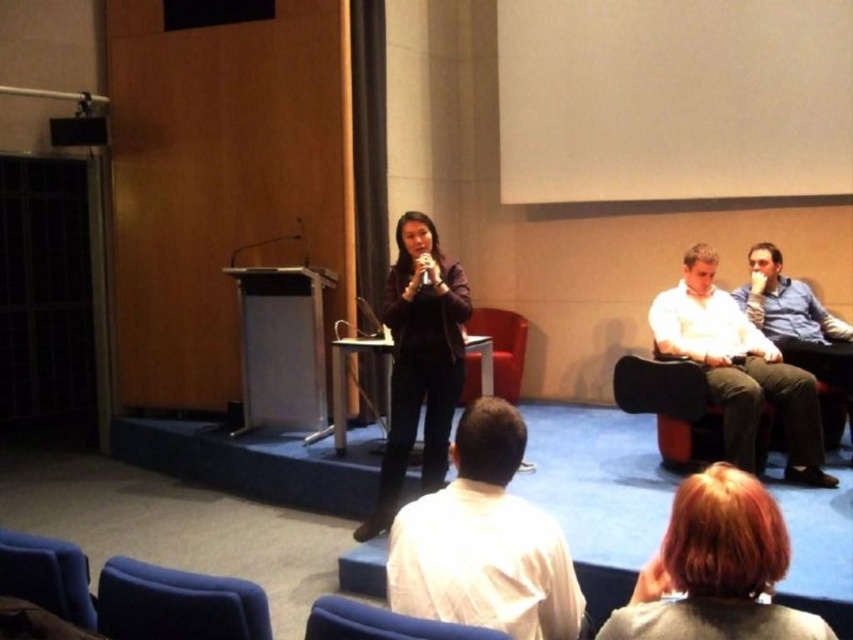
Does point (421, 291) come farther from viewer compared to point (10, 556)?

Yes.

Does matte black jacket at center have a greater height compared to velvet blue chair at lower left?

Yes, matte black jacket at center is taller than velvet blue chair at lower left.

Is point (401, 412) less distant than point (44, 600)?

No, (401, 412) is behind (44, 600).

Find the location of a particular element. This screenshot has width=853, height=640. matte black jacket at center is located at coordinates pos(419,362).

Who is more forward, [711,324] or [202,589]?

Point [202,589]

Does white cotton shirt at right appear under blue fabric chair at lower left?

No, white cotton shirt at right is not below blue fabric chair at lower left.

Between point (815, 456) and point (196, 609), which one is positioned behind?

The point (815, 456) is behind.

I want to click on white cotton shirt at right, so click(740, 369).

Can you confirm if blue fabric chair at lower left is thinner than dark brown leather chair at center?

Yes.

The image size is (853, 640). What do you see at coordinates (177, 604) in the screenshot?
I see `blue fabric chair at lower left` at bounding box center [177, 604].

Which is behind, point (148, 566) or point (676, 422)?

The point (676, 422) is behind.

Image resolution: width=853 pixels, height=640 pixels. In order to click on blue fabric chair at lower left in this screenshot , I will do `click(177, 604)`.